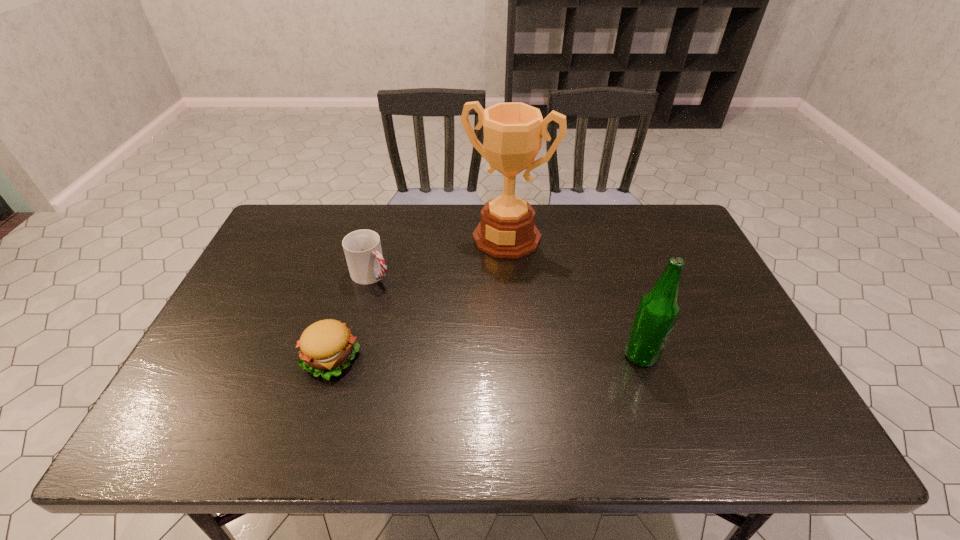
Find the location of a particular element. This screenshot has height=540, width=960. vacant space on the desktop that is between the shortest object and the second tallest object and is positioned on the handle side of the second farthest object is located at coordinates (487, 357).

Find the location of a particular element. The image size is (960, 540). vacant space on the desktop that is between the shortest object and the rightmost object and is positioned on the front-facing side of the award is located at coordinates (444, 357).